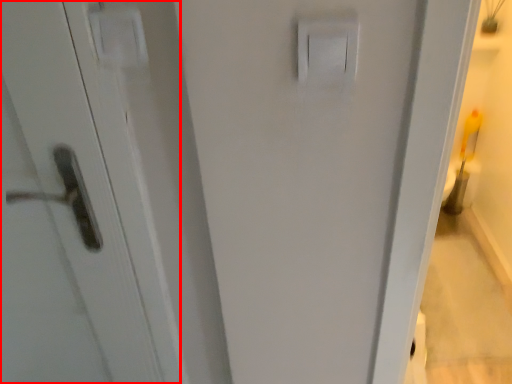
Question: From the image's perspective, considering the relative positions of screen door (annotated by the red box) and light switch in the image provided, where is screen door (annotated by the red box) located with respect to the staircase?

Choices:
 (A) above
 (B) below

Answer: (B)